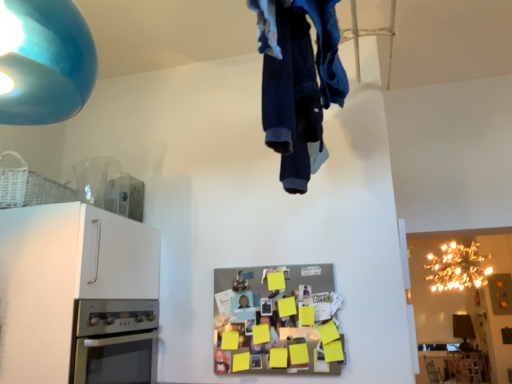
The height and width of the screenshot is (384, 512). Identify the location of free space above metallic silver refrigerator at center (from a real-world perspective). (270, 267).